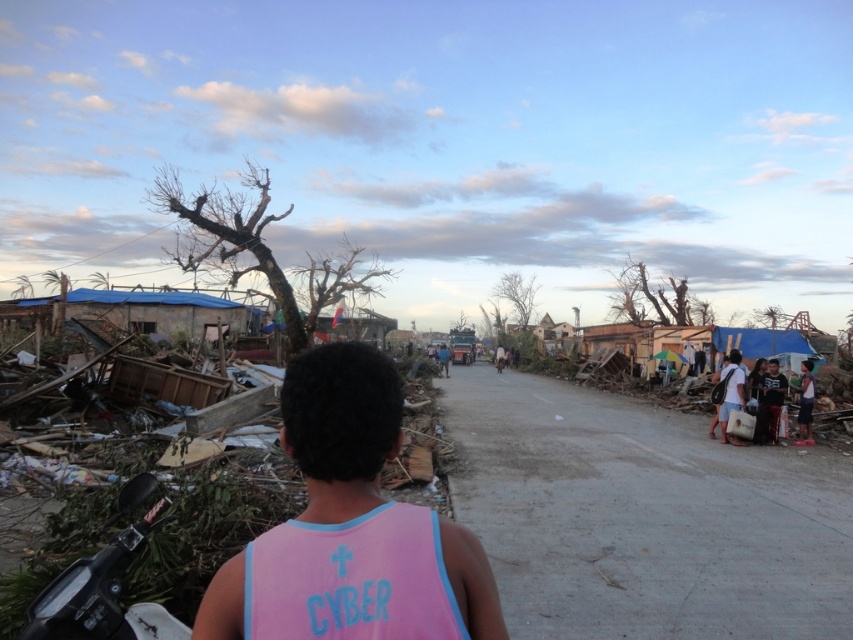
Question: Does bare wood tree at upper right have a lesser width compared to brown rough tree at left?

Choices:
 (A) no
 (B) yes

Answer: (B)

Question: Can you confirm if gravel road at center is thinner than brown rough tree at left?

Choices:
 (A) no
 (B) yes

Answer: (B)

Question: Based on their relative distances, which object is farther from the brown bark tree at center?

Choices:
 (A) blue fabric shirt at center
 (B) bare wood tree at upper right
 (C) dark gray shirt at right
 (D) pink fabric shirt at center

Answer: (B)

Question: Based on their relative distances, which object is farther from the matte white bag at right?

Choices:
 (A) brown bark tree at center
 (B) dark gray shirt at right
 (C) pink fabric shirt at center

Answer: (A)

Question: Which object is farther from the camera taking this photo?

Choices:
 (A) brown rough tree at left
 (B) matte white bag at right
 (C) dark gray shirt at right

Answer: (A)

Question: Is bare wood tree at upper center smaller than matte white bag at right?

Choices:
 (A) no
 (B) yes

Answer: (A)